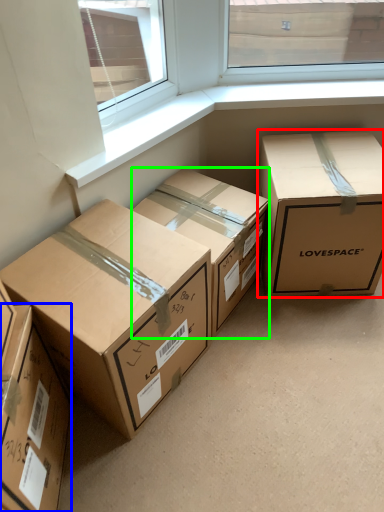
Question: Which is farther away from box (highlighted by a red box)? box (highlighted by a blue box) or box (highlighted by a green box)?

Choices:
 (A) box
 (B) box

Answer: (A)